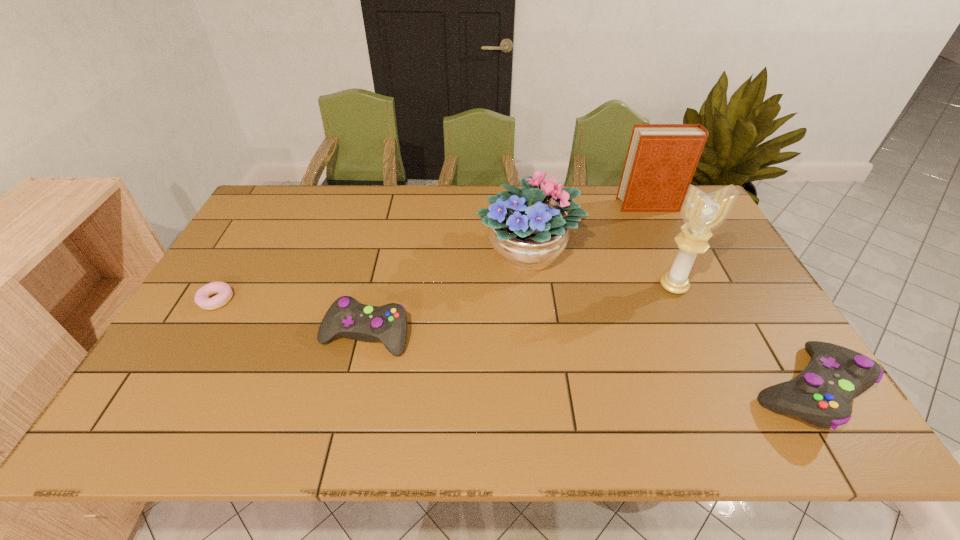
Identify which object is the fourth closest to the farthest object. Please provide its 2D coordinates. Your answer should be formatted as a tuple, i.e. [(x, y)], where the tuple contains the x and y coordinates of a point satisfying the conditions above.

[(346, 316)]

Identify the location of free region that satisfies the following two spatial constraints: 1. on the open cover of the right control; 2. on the right side of the hardback book. (736, 389).

I want to click on vacant space that satisfies the following two spatial constraints: 1. on the back side of the third object from left to right; 2. on the right side of the shorter control, so click(385, 252).

Where is `free location that satisfies the following two spatial constraints: 1. on the front side of the doughnut; 2. on the right side of the fourth tallest object`? The height and width of the screenshot is (540, 960). free location that satisfies the following two spatial constraints: 1. on the front side of the doughnut; 2. on the right side of the fourth tallest object is located at coordinates (164, 389).

I want to click on free location that satisfies the following two spatial constraints: 1. on the back side of the bouquet; 2. on the right side of the doughnut, so click(245, 252).

The image size is (960, 540). Identify the location of free spot that satisfies the following two spatial constraints: 1. on the open cover of the farthest object; 2. on the left side of the fourth tallest object. (736, 389).